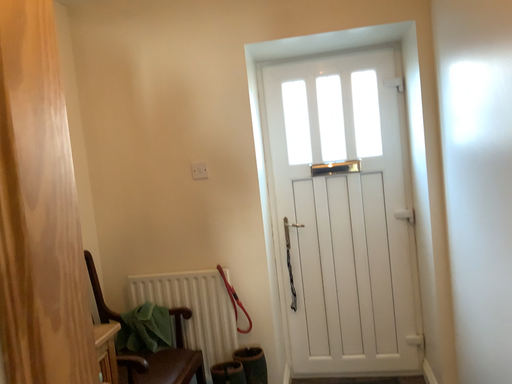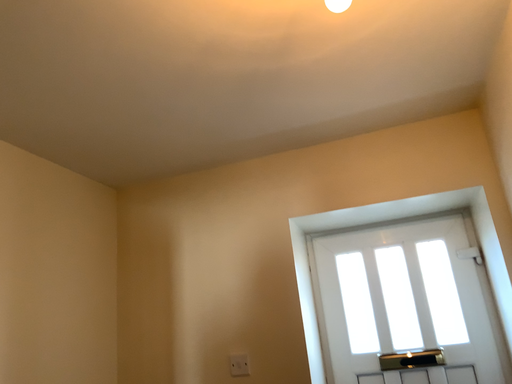
Question: Which way did the camera rotate in the video?

Choices:
 (A) rotated right
 (B) rotated left

Answer: (B)